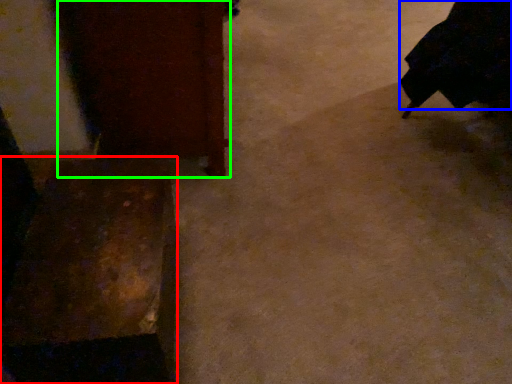
Question: Which object is positioned farthest from furniture (highlighted by a red box)? Select from robe (highlighted by a blue box) and furniture (highlighted by a green box).

Choices:
 (A) robe
 (B) furniture

Answer: (A)